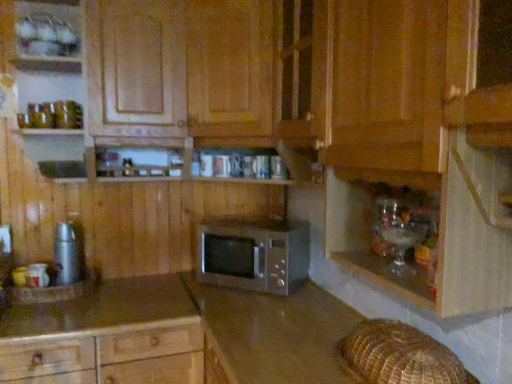
Where is `vacant area that lies in front of metallic silver thermos at left`? vacant area that lies in front of metallic silver thermos at left is located at coordinates pos(46,299).